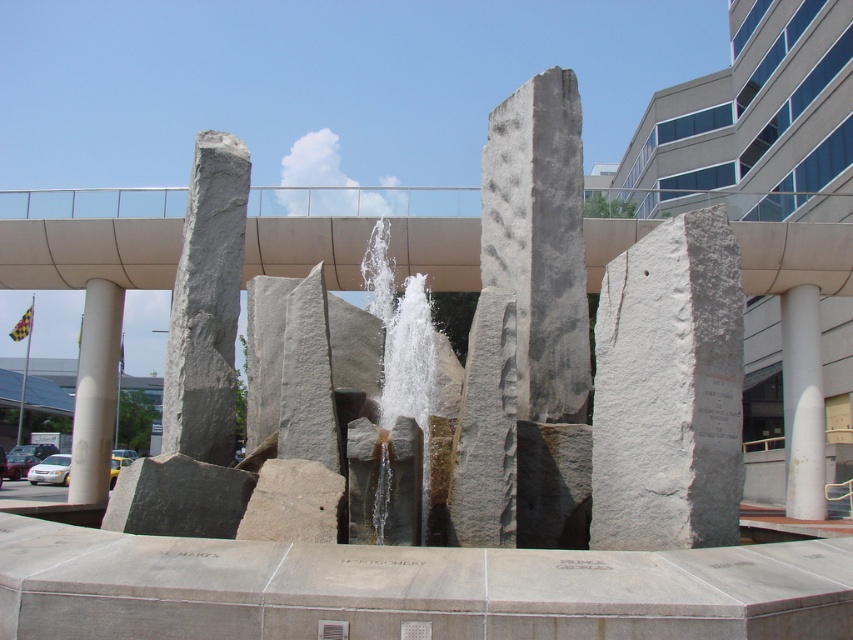
You are an architect analyzing the sculpture. Which object has a greater width between the gray rough stone pillar at upper left and the white stone waterfall at center?

The gray rough stone pillar at upper left has a greater width than the white stone waterfall at center according to the description.

You are standing at the origin point of the image coordinate system. Which direction should you move to reach the white smooth column at right?

The white smooth column at right is located at coordinate point 0.631 on the x axis and 0.941 on the y axis. Since the origin is at the bottom left corner of the image, you should move to the right and upwards to reach it.